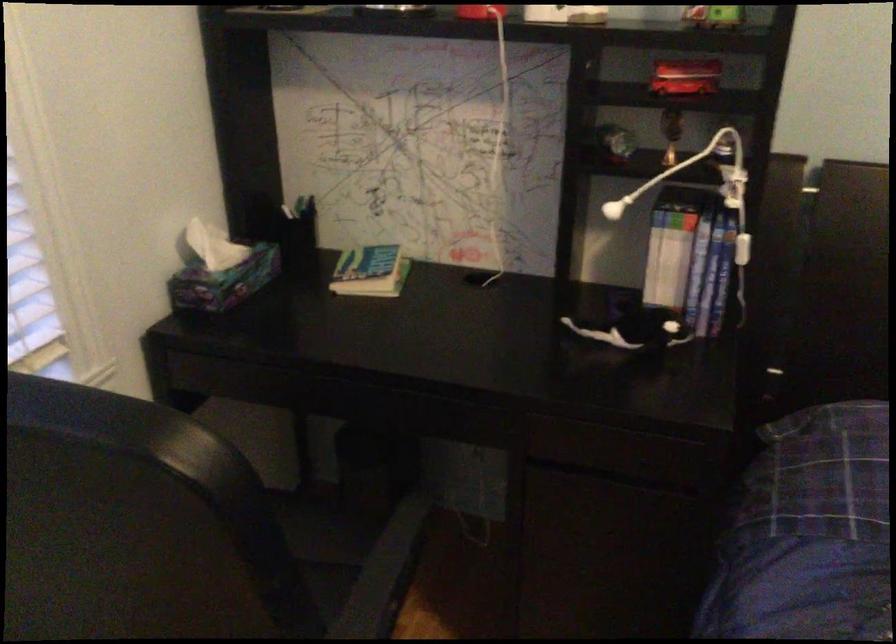
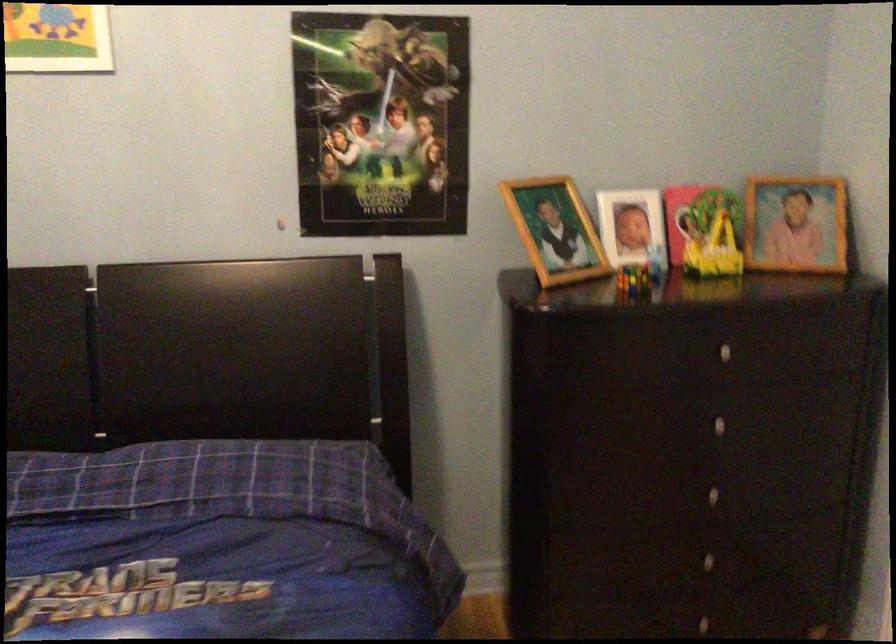
In a continuous first-person perspective shot, in which direction is the camera moving?

The movement direction of the cameraman is right, backward.